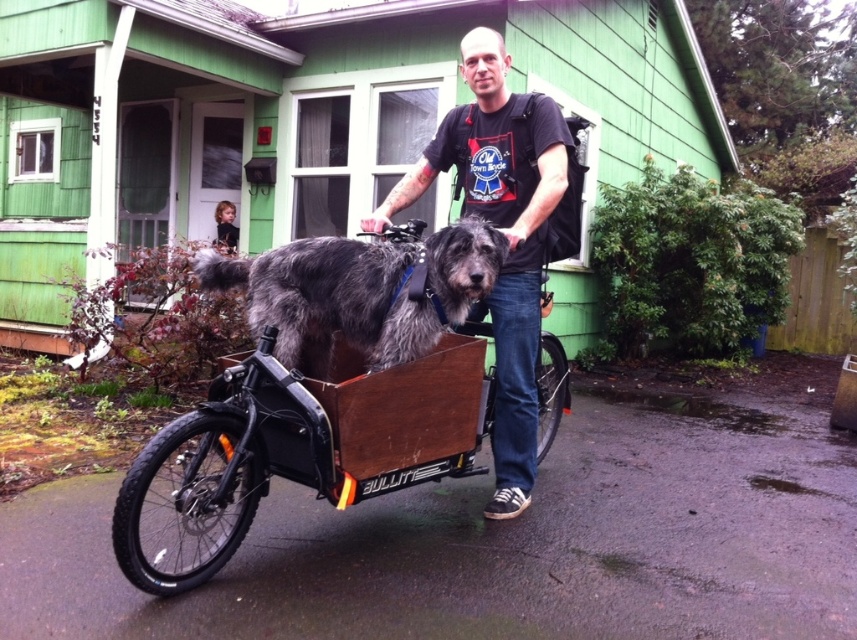
Question: Is matte black t-shirt at center smaller than wooden box at center?

Choices:
 (A) yes
 (B) no

Answer: (B)

Question: Based on their relative distances, which object is nearer to the wooden box at center?

Choices:
 (A) matte black t-shirt at center
 (B) gray woolen dog at center

Answer: (A)

Question: Based on their relative distances, which object is farther from the matte black t-shirt at center?

Choices:
 (A) wooden box at center
 (B) gray woolen dog at center

Answer: (A)

Question: Is matte black t-shirt at center to the left of wooden box at center from the viewer's perspective?

Choices:
 (A) no
 (B) yes

Answer: (B)

Question: Which object is farther from the camera taking this photo?

Choices:
 (A) matte black t-shirt at center
 (B) gray woolen dog at center

Answer: (A)

Question: In this image, where is matte black t-shirt at center located relative to gray woolen dog at center?

Choices:
 (A) right
 (B) left

Answer: (A)